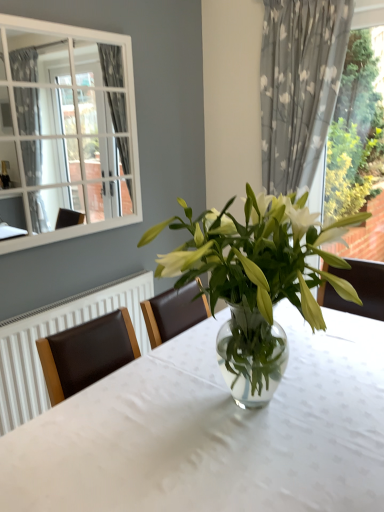
Question: Can you confirm if transparent glass vase at center is bigger than gray floral fabric curtain at right?

Choices:
 (A) no
 (B) yes

Answer: (B)

Question: Does transparent glass vase at center lie behind gray floral fabric curtain at right?

Choices:
 (A) yes
 (B) no

Answer: (B)

Question: Are transparent glass vase at center and gray floral fabric curtain at right beside each other?

Choices:
 (A) yes
 (B) no

Answer: (B)

Question: From the image's perspective, is transparent glass vase at center above gray floral fabric curtain at right?

Choices:
 (A) no
 (B) yes

Answer: (A)

Question: Does transparent glass vase at center have a lesser height compared to gray floral fabric curtain at right?

Choices:
 (A) no
 (B) yes

Answer: (B)

Question: Looking at their shapes, would you say green leafy plant at right is wider or thinner than clear glass vase at center?

Choices:
 (A) thin
 (B) wide

Answer: (A)

Question: In the image, is green leafy plant at right positioned in front of or behind clear glass vase at center?

Choices:
 (A) behind
 (B) front

Answer: (A)

Question: Is green leafy plant at right bigger or smaller than clear glass vase at center?

Choices:
 (A) big
 (B) small

Answer: (B)

Question: Is green leafy plant at right taller or shorter than clear glass vase at center?

Choices:
 (A) short
 (B) tall

Answer: (B)

Question: Is green leafy plant at right taller or shorter than transparent glass vase at center?

Choices:
 (A) tall
 (B) short

Answer: (A)

Question: In terms of width, does green leafy plant at right look wider or thinner when compared to transparent glass vase at center?

Choices:
 (A) thin
 (B) wide

Answer: (A)

Question: Which is correct: green leafy plant at right is inside transparent glass vase at center, or outside of it?

Choices:
 (A) outside
 (B) inside

Answer: (A)

Question: Based on their positions, is green leafy plant at right located to the left or right of transparent glass vase at center?

Choices:
 (A) right
 (B) left

Answer: (A)

Question: From a real-world perspective, relative to gray floral fabric curtain at right, is transparent glass vase at center vertically above or below?

Choices:
 (A) above
 (B) below

Answer: (B)

Question: Do you think transparent glass vase at center is within gray floral fabric curtain at right, or outside of it?

Choices:
 (A) outside
 (B) inside

Answer: (A)